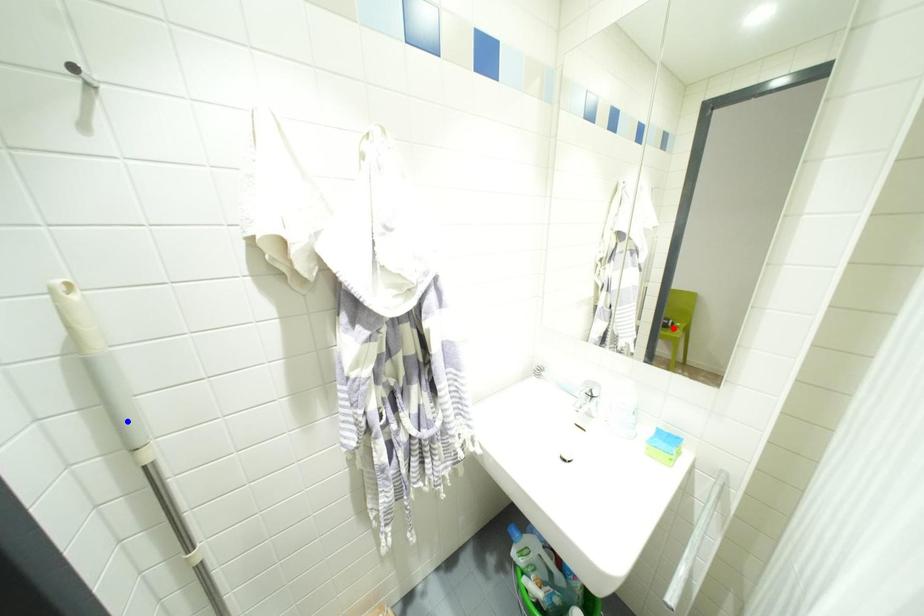
Question: Which of the two points in the image is closer to the camera?

Choices:
 (A) Blue point is closer.
 (B) Red point is closer.

Answer: (A)